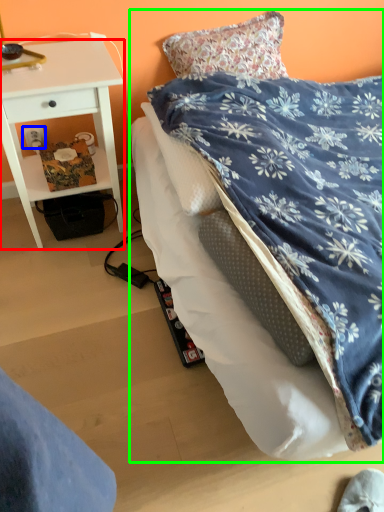
Question: Estimate the real-world distances between objects in this image. Which object is closer to desk (highlighted by a red box), power outlet (highlighted by a blue box) or bed (highlighted by a green box)?

Choices:
 (A) power outlet
 (B) bed

Answer: (A)